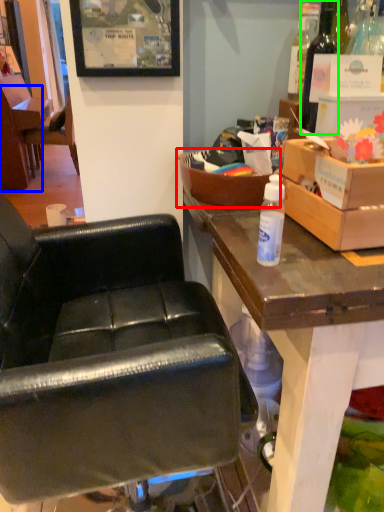
Question: Which object is the farthest from box (highlighted by a red box)? Choose among these: chair (highlighted by a blue box) or bottle (highlighted by a green box).

Choices:
 (A) chair
 (B) bottle

Answer: (A)